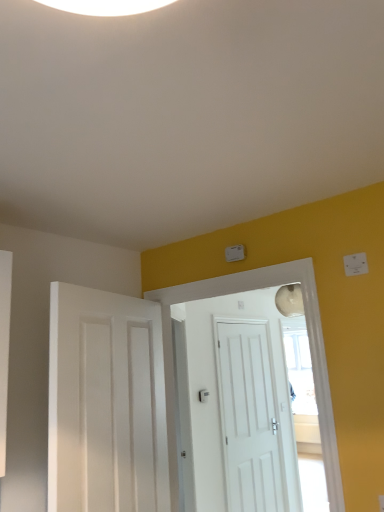
The image size is (384, 512). Find the location of `white matte door at left, which is the first door in front-to-back order`. white matte door at left, which is the first door in front-to-back order is located at coordinates click(x=106, y=403).

Locate an element on the screen. Image resolution: width=384 pixels, height=512 pixels. white plastic light switch at upper right is located at coordinates (355, 264).

I want to click on white matte door at center, arranged as the third door when viewed from the front, so click(x=249, y=417).

Is white matte door at center, acting as the second door starting from the front, situated inside white matte door at center, arranged as the third door when viewed from the front, or outside?

white matte door at center, acting as the second door starting from the front, is located beyond the bounds of white matte door at center, arranged as the third door when viewed from the front.

Is point (48, 457) in front of point (272, 422)?

Yes.

From a real-world perspective, is white matte door at center, acting as the second door starting from the front, located higher than white matte door at center, marked as the first door in a back-to-front arrangement?

Yes, from a real-world perspective, white matte door at center, acting as the second door starting from the front, is above white matte door at center, marked as the first door in a back-to-front arrangement.

Between white matte door at center, acting as the second door starting from the front, and white matte door at center, arranged as the third door when viewed from the front, which one has less height?

Standing shorter between the two is white matte door at center, acting as the second door starting from the front.

Can you confirm if white matte door at center, arranged as the third door when viewed from the front, is positioned to the right of white plastic light switch at upper right?

Incorrect, white matte door at center, arranged as the third door when viewed from the front, is not on the right side of white plastic light switch at upper right.

Is white matte door at center, marked as the first door in a back-to-front arrangement, situated inside white plastic light switch at upper right or outside?

white matte door at center, marked as the first door in a back-to-front arrangement, lies outside white plastic light switch at upper right.

Which point is more distant from viewer, [257,424] or [161,380]?

The point [257,424] is farther.

From a real-world perspective, is white matte door at center, marked as the first door in a back-to-front arrangement, positioned above or below white matte door at left, which is the first door in front-to-back order?

From a real-world perspective, white matte door at center, marked as the first door in a back-to-front arrangement, is physically below white matte door at left, which is the first door in front-to-back order.

Choose the correct answer: Is white matte door at center, arranged as the third door when viewed from the front, inside white matte door at left, marked as the 3th door in a back-to-front arrangement, or outside it?

white matte door at center, arranged as the third door when viewed from the front, is located beyond the bounds of white matte door at left, marked as the 3th door in a back-to-front arrangement.

Is white matte door at center, acting as the second door starting from the front, positioned far away from white plastic light switch at upper right?

Actually, white matte door at center, acting as the second door starting from the front, and white plastic light switch at upper right are a little close together.

Looking at this image, considering the sizes of objects white matte door at center, which is the second door from back to front, and white plastic light switch at upper right in the image provided, who is taller, white matte door at center, which is the second door from back to front, or white plastic light switch at upper right?

white matte door at center, which is the second door from back to front.

How different are the orientations of white matte door at center, acting as the second door starting from the front, and white plastic light switch at upper right in degrees?

0.117 degrees separate the facing orientations of white matte door at center, acting as the second door starting from the front, and white plastic light switch at upper right.

Which object is thinner, white matte door at center, acting as the second door starting from the front, or white plastic light switch at upper right?

Thinner between the two is white plastic light switch at upper right.

Is white matte door at center, which is the second door from back to front, facing away from white matte door at left, marked as the 3th door in a back-to-front arrangement?

Yes, white matte door at center, which is the second door from back to front,'s orientation is away from white matte door at left, marked as the 3th door in a back-to-front arrangement.

Which of these two, white matte door at center, acting as the second door starting from the front, or white matte door at left, marked as the 3th door in a back-to-front arrangement, stands shorter?

Standing shorter between the two is white matte door at left, marked as the 3th door in a back-to-front arrangement.

In the image, is white matte door at center, acting as the second door starting from the front, positioned in front of or behind white matte door at left, which is the first door in front-to-back order?

white matte door at center, acting as the second door starting from the front, is positioned farther from the viewer than white matte door at left, which is the first door in front-to-back order.

Is white matte door at center, arranged as the third door when viewed from the front, positioned far away from white matte door at center, acting as the second door starting from the front?

That's right, there is a large distance between white matte door at center, arranged as the third door when viewed from the front, and white matte door at center, acting as the second door starting from the front.

Does white matte door at center, marked as the first door in a back-to-front arrangement, have a greater width compared to white matte door at center, which is the second door from back to front?

In fact, white matte door at center, marked as the first door in a back-to-front arrangement, might be narrower than white matte door at center, which is the second door from back to front.

The height and width of the screenshot is (512, 384). I want to click on door located behind the white matte door at center, acting as the second door starting from the front, so click(249, 417).

Is point (258, 508) closer or farther from the camera than point (268, 284)?

Clearly, point (258, 508) is more distant from the camera than point (268, 284).

Considering the relative sizes of white matte door at left, which is the first door in front-to-back order, and white matte door at center, arranged as the third door when viewed from the front, in the image provided, is white matte door at left, which is the first door in front-to-back order, taller than white matte door at center, arranged as the third door when viewed from the front,?

No.

Would you say white matte door at left, marked as the 3th door in a back-to-front arrangement, contains white matte door at center, marked as the first door in a back-to-front arrangement?

No, white matte door at center, marked as the first door in a back-to-front arrangement, is not surrounded by white matte door at left, marked as the 3th door in a back-to-front arrangement.

From the image's perspective, which one is positioned lower, white matte door at left, marked as the 3th door in a back-to-front arrangement, or white matte door at center, marked as the first door in a back-to-front arrangement?

white matte door at center, marked as the first door in a back-to-front arrangement.

How far apart are white matte door at left, marked as the 3th door in a back-to-front arrangement, and white matte door at center, marked as the first door in a back-to-front arrangement?

They are 2.08 meters apart.

Where is `door that appears below the white matte door at center, acting as the second door starting from the front (from the image's perspective)`? Image resolution: width=384 pixels, height=512 pixels. door that appears below the white matte door at center, acting as the second door starting from the front (from the image's perspective) is located at coordinates (249, 417).

Find the location of a particular element. The width and height of the screenshot is (384, 512). door that is behind the white plastic light switch at upper right is located at coordinates (249, 417).

Based on their spatial positions, is white matte door at center, arranged as the third door when viewed from the front, or white plastic light switch at upper right closer to white matte door at center, which is the second door from back to front?

Based on the image, white plastic light switch at upper right appears to be nearer to white matte door at center, which is the second door from back to front.

From the image, which object appears to be nearer to white matte door at left, marked as the 3th door in a back-to-front arrangement, white matte door at center, acting as the second door starting from the front, or white plastic light switch at upper right?

white matte door at center, acting as the second door starting from the front, lies closer to white matte door at left, marked as the 3th door in a back-to-front arrangement, than the other object.

Looking at the image, which one is located further to white matte door at center, arranged as the third door when viewed from the front, white matte door at left, which is the first door in front-to-back order, or white matte door at center, acting as the second door starting from the front?

white matte door at left, which is the first door in front-to-back order, is further to white matte door at center, arranged as the third door when viewed from the front.

Looking at the image, which one is located further to white matte door at center, which is the second door from back to front, white matte door at center, marked as the first door in a back-to-front arrangement, or white matte door at left, which is the first door in front-to-back order?

white matte door at center, marked as the first door in a back-to-front arrangement, is further to white matte door at center, which is the second door from back to front.

From the picture: From the image, which object appears to be farther from white matte door at center, marked as the first door in a back-to-front arrangement, white matte door at center, which is the second door from back to front, or white plastic light switch at upper right?

Based on the image, white plastic light switch at upper right appears to be further to white matte door at center, marked as the first door in a back-to-front arrangement.

Based on their spatial positions, is white plastic light switch at upper right or white matte door at center, which is the second door from back to front, closer to white matte door at center, arranged as the third door when viewed from the front?

Among the two, white matte door at center, which is the second door from back to front, is located nearer to white matte door at center, arranged as the third door when viewed from the front.

In the scene shown: From the image, which object appears to be nearer to white matte door at center, marked as the first door in a back-to-front arrangement, white plastic light switch at upper right or white matte door at left, which is the first door in front-to-back order?

white matte door at left, which is the first door in front-to-back order, lies closer to white matte door at center, marked as the first door in a back-to-front arrangement, than the other object.

Looking at the image, which one is located further to white plastic light switch at upper right, white matte door at center, marked as the first door in a back-to-front arrangement, or white matte door at center, acting as the second door starting from the front?

Based on the image, white matte door at center, marked as the first door in a back-to-front arrangement, appears to be further to white plastic light switch at upper right.

Where is `door between white matte door at left, marked as the 3th door in a back-to-front arrangement, and white matte door at center, arranged as the third door when viewed from the front, from front to back`? Image resolution: width=384 pixels, height=512 pixels. door between white matte door at left, marked as the 3th door in a back-to-front arrangement, and white matte door at center, arranged as the third door when viewed from the front, from front to back is located at coordinates (310, 346).

This screenshot has height=512, width=384. Find the location of `light switch located between white matte door at center, acting as the second door starting from the front, and white matte door at center, arranged as the third door when viewed from the front, in the depth direction`. light switch located between white matte door at center, acting as the second door starting from the front, and white matte door at center, arranged as the third door when viewed from the front, in the depth direction is located at coordinates (355, 264).

Find the location of a particular element. The width and height of the screenshot is (384, 512). light switch between white matte door at left, which is the first door in front-to-back order, and white matte door at center, marked as the first door in a back-to-front arrangement, along the z-axis is located at coordinates (355, 264).